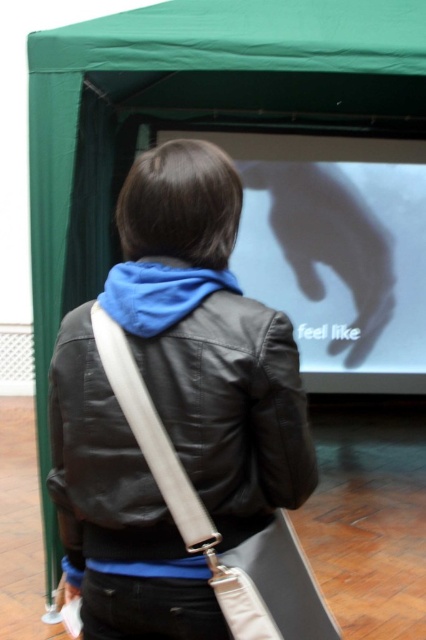
Describe the element at coordinates (219, 388) in the screenshot. Image resolution: width=426 pixels, height=640 pixels. I see `black leather jacket at center` at that location.

Find the location of `black leather jacket at center`. black leather jacket at center is located at coordinates (219, 388).

Is black leather jacket at center bigger than blue fleece scarf at upper center?

Correct, black leather jacket at center is larger in size than blue fleece scarf at upper center.

At what (x,y) coordinates should I click in order to perform the action: click on black leather jacket at center. Please return your answer as a coordinate pair (x, y). The width and height of the screenshot is (426, 640). Looking at the image, I should click on (219, 388).

Where is `black leather jacket at center`? This screenshot has width=426, height=640. black leather jacket at center is located at coordinates (219, 388).

Does point (304, 276) come closer to viewer compared to point (112, 314)?

No.

Which is in front, point (408, 324) or point (187, 268)?

Point (187, 268)

You are a GUI agent. You are given a task and a screenshot of the screen. Output one action in this format:
    pyautogui.click(x=<x>, y=<y>)
    Task: Click on the white glossy projection screen at center
    The height and width of the screenshot is (640, 426).
    Given the screenshot: What is the action you would take?
    pyautogui.click(x=336, y=252)